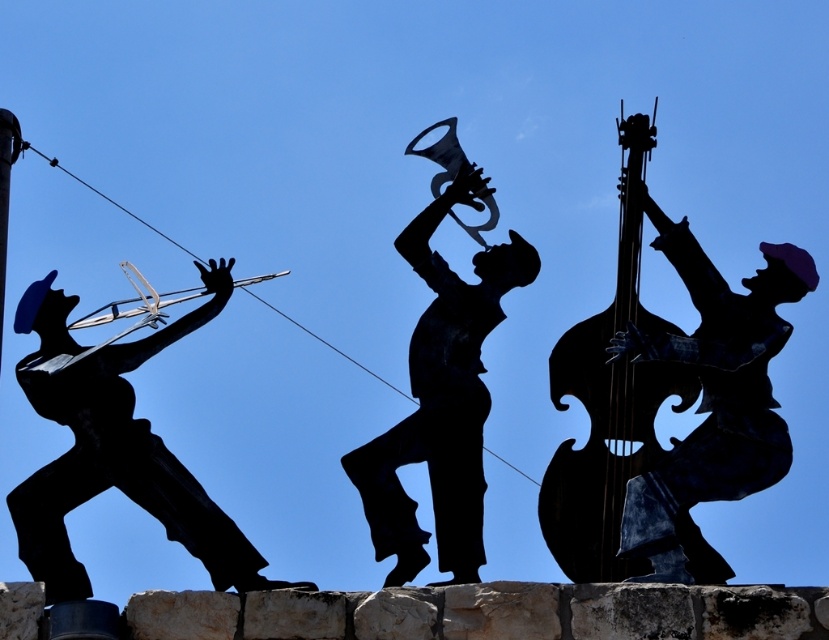
You are an art student analyzing the sculpture. You notice the black matte violin at left and the black metal trumpet at center. Which object is shorter in height?

The black matte violin at left is shorter in height than the black metal trumpet at center because it is not as tall as the trumpet.

You are a photographer trying to capture the black matte bass at right and the metallic dark brown cello at right in a single shot. Based on their positions, which one should you adjust your camera angle downward to include in the frame first?

The black matte bass at right is located below the metallic dark brown cello at right, so you should adjust your camera angle downward to include the black matte bass at right first.